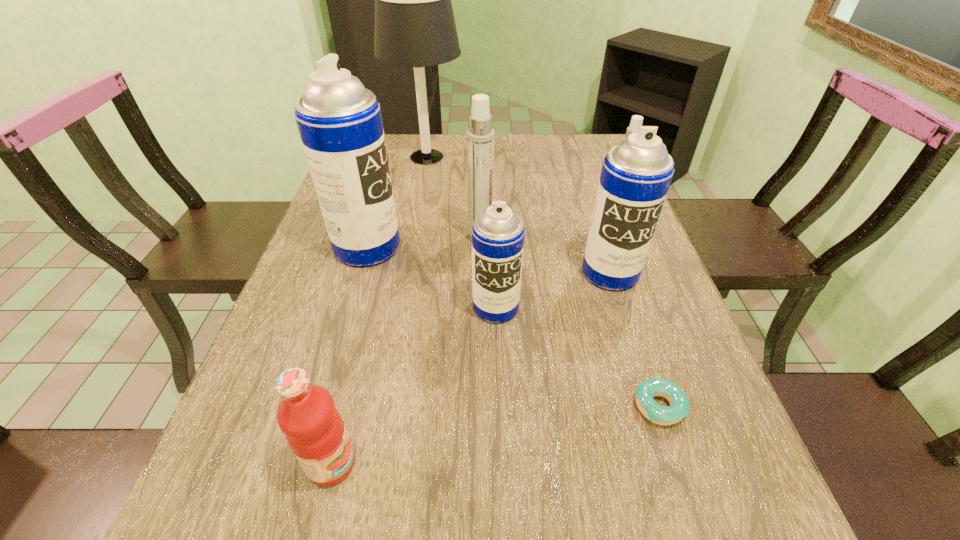
The width and height of the screenshot is (960, 540). Identify the location of free spot at the far right corner of the desktop. (586, 158).

Where is `empty location between the doughnut and the smallest blue aerosol can`? The height and width of the screenshot is (540, 960). empty location between the doughnut and the smallest blue aerosol can is located at coordinates (578, 357).

What are the coordinates of `vacant area that lies between the nearer white aerosol can and the nearest object` in the screenshot? It's located at point(406,350).

Locate an element on the screen. unoccupied position between the leftmost blue aerosol can and the farthest object is located at coordinates (397, 202).

Identify the location of free space between the doughnut and the bigger white aerosol can. (570, 322).

Where is `vacant region between the smallest blue aerosol can and the right white aerosol can`? This screenshot has height=540, width=960. vacant region between the smallest blue aerosol can and the right white aerosol can is located at coordinates (555, 260).

Where is `empty space that is in between the second blue aerosol can from left to right and the seventh tallest object`? The width and height of the screenshot is (960, 540). empty space that is in between the second blue aerosol can from left to right and the seventh tallest object is located at coordinates (414, 386).

I want to click on vacant area between the nearest object and the table lamp, so click(379, 310).

Identify the location of unoccupied position between the shortest object and the seventh tallest object. (495, 435).

This screenshot has height=540, width=960. Find the location of `free space between the second blue aerosol can from left to right and the leftmost aerosol can`. free space between the second blue aerosol can from left to right and the leftmost aerosol can is located at coordinates pos(432,277).